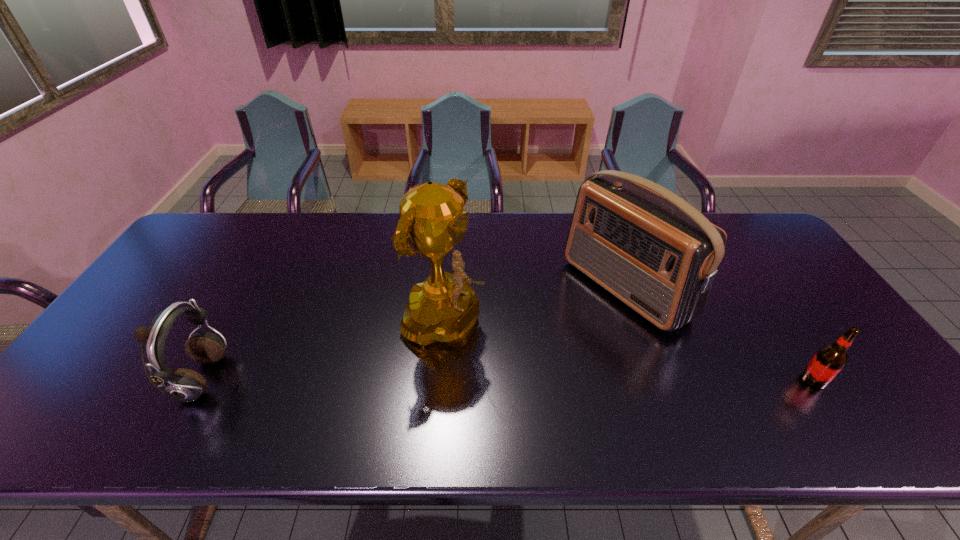
Where is `free space between the earphone and the rightmost object`? The width and height of the screenshot is (960, 540). free space between the earphone and the rightmost object is located at coordinates (508, 380).

This screenshot has height=540, width=960. I want to click on free space between the shortest object and the third tallest object, so click(x=508, y=380).

Image resolution: width=960 pixels, height=540 pixels. I want to click on vacant area between the second object from right to left and the award, so click(534, 306).

The width and height of the screenshot is (960, 540). What are the coordinates of `vacant region between the leftmost object and the second object from left to right` in the screenshot? It's located at (323, 352).

Find the location of a particular element. The height and width of the screenshot is (540, 960). vacant area that lies between the award and the rightmost object is located at coordinates (629, 352).

Where is `the second closest object relative to the shortest object`? The width and height of the screenshot is (960, 540). the second closest object relative to the shortest object is located at coordinates (444, 308).

Select which object appears as the second closest to the third shortest object. Please provide its 2D coordinates. Your answer should be formatted as a tuple, i.e. [(x, y)], where the tuple contains the x and y coordinates of a point satisfying the conditions above.

[(444, 308)]

Identify the location of vacant space that satisfies the following two spatial constraints: 1. on the front side of the shortest object; 2. on the right side of the radio receiver. (658, 380).